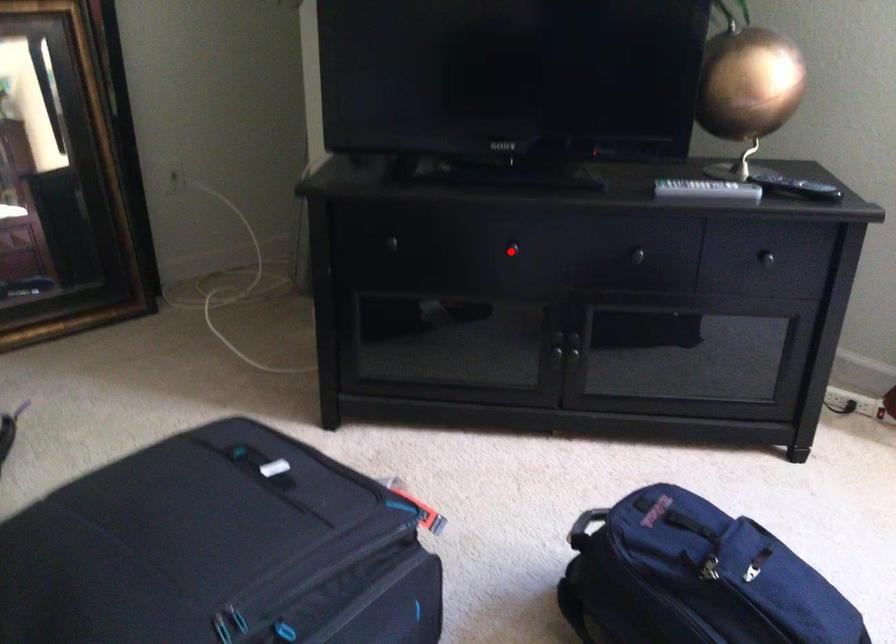
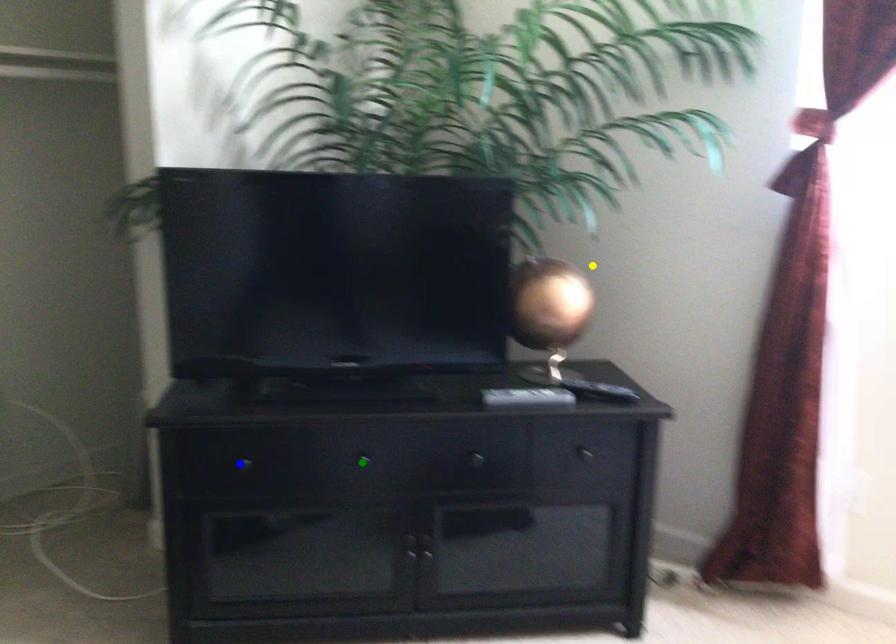
Question: I am providing you with two images of the same scene from different viewpoints. A red point is marked on the first image. You are given multiple points on the second image. Which spot in image 2 lines up with the point in image 1?

Choices:
 (A) yellow point
 (B) blue point
 (C) green point

Answer: (C)